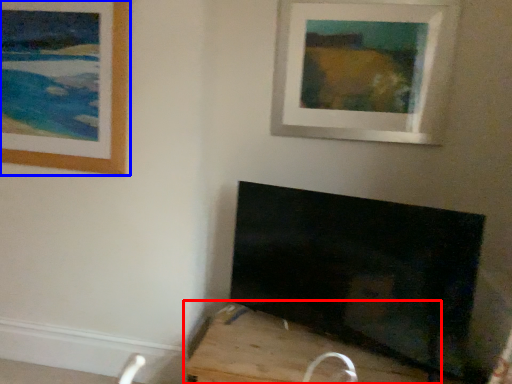
Question: Which of the following is the farthest to the observer, furniture (highlighted by a red box) or picture frame (highlighted by a blue box)?

Choices:
 (A) furniture
 (B) picture frame

Answer: (B)